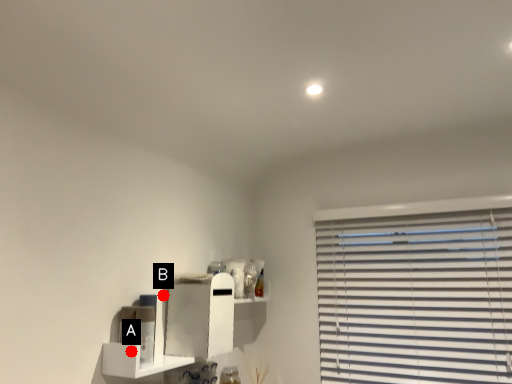
Question: Two points are circled on the image, labeled by A and B beside each circle. Among these points, which one is farthest from the camera?

Choices:
 (A) A is further
 (B) B is further

Answer: (B)